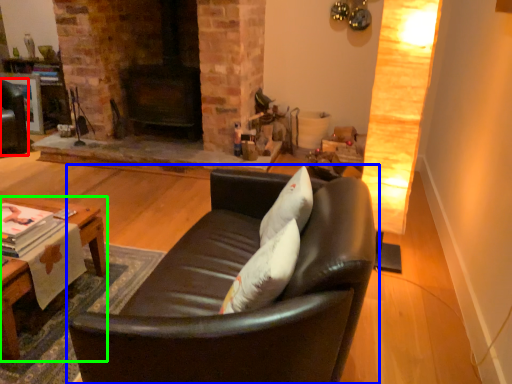
Question: Which is farther away from swivel chair (highlighted by a red box)? studio couch (highlighted by a blue box) or table (highlighted by a green box)?

Choices:
 (A) studio couch
 (B) table

Answer: (A)